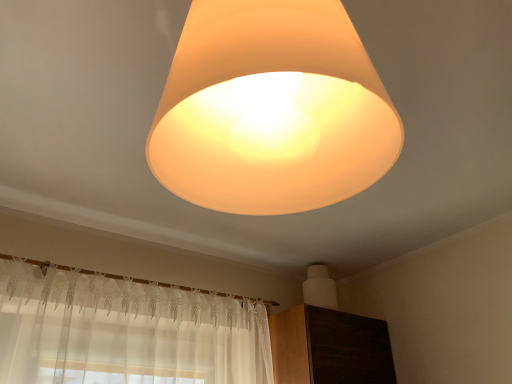
The height and width of the screenshot is (384, 512). Describe the element at coordinates (329, 347) in the screenshot. I see `dark wood dresser at lower right` at that location.

You are a GUI agent. You are given a task and a screenshot of the screen. Output one action in this format:
    pyautogui.click(x=<x>, y=<y>)
    Task: Click on the dark wood dresser at lower right
    The image size is (512, 384).
    Given the screenshot: What is the action you would take?
    pyautogui.click(x=329, y=347)

This screenshot has width=512, height=384. Describe the element at coordinates (272, 110) in the screenshot. I see `matte orange lampshade at upper center` at that location.

Where is `matte orange lampshade at upper center`? The width and height of the screenshot is (512, 384). matte orange lampshade at upper center is located at coordinates (272, 110).

At what (x,y) coordinates should I click in order to perform the action: click on dark wood dresser at lower right. Please return your answer as a coordinate pair (x, y). The width and height of the screenshot is (512, 384). Looking at the image, I should click on (329, 347).

Is matte orange lampshade at upper center at the right side of dark wood dresser at lower right?

In fact, matte orange lampshade at upper center is to the left of dark wood dresser at lower right.

Consider the image. Does matte orange lampshade at upper center lie behind dark wood dresser at lower right?

No, matte orange lampshade at upper center is closer to the camera.

Considering the positions of points (300, 151) and (380, 366), is point (300, 151) farther from camera compared to point (380, 366)?

No.

From the image's perspective, which is above, matte orange lampshade at upper center or dark wood dresser at lower right?

matte orange lampshade at upper center appears higher in the image.

From a real-world perspective, is matte orange lampshade at upper center over dark wood dresser at lower right?

Yes, from a real-world perspective, matte orange lampshade at upper center is over dark wood dresser at lower right

Considering the sizes of matte orange lampshade at upper center and dark wood dresser at lower right in the image, is matte orange lampshade at upper center wider or thinner than dark wood dresser at lower right?

Clearly, matte orange lampshade at upper center has less width compared to dark wood dresser at lower right.

In terms of height, does matte orange lampshade at upper center look taller or shorter compared to dark wood dresser at lower right?

matte orange lampshade at upper center is taller than dark wood dresser at lower right.

Is matte orange lampshade at upper center smaller than dark wood dresser at lower right?

Correct, matte orange lampshade at upper center occupies less space than dark wood dresser at lower right.

Is matte orange lampshade at upper center outside of dark wood dresser at lower right?

That's correct, matte orange lampshade at upper center is outside of dark wood dresser at lower right.

Is matte orange lampshade at upper center next to dark wood dresser at lower right and touching it?

No, matte orange lampshade at upper center is not with dark wood dresser at lower right.

Is matte orange lampshade at upper center facing towards dark wood dresser at lower right?

No, matte orange lampshade at upper center is not aimed at dark wood dresser at lower right.

Looking at this image, how different are the orientations of matte orange lampshade at upper center and dark wood dresser at lower right in degrees?

The angle between the facing direction of matte orange lampshade at upper center and the facing direction of dark wood dresser at lower right is 100 degrees.

How distant is matte orange lampshade at upper center from dark wood dresser at lower right?

The distance of matte orange lampshade at upper center from dark wood dresser at lower right is 4.88 feet.

There is a dark wood dresser at lower right. Identify the location of lamp above it (from a real-world perspective). (272, 110).

In the scene shown: Which is more to the left, dark wood dresser at lower right or matte orange lampshade at upper center?

Positioned to the left is matte orange lampshade at upper center.

Considering the relative positions of dark wood dresser at lower right and matte orange lampshade at upper center in the image provided, is dark wood dresser at lower right in front of matte orange lampshade at upper center?

No, dark wood dresser at lower right is behind matte orange lampshade at upper center.

Does point (375, 328) come closer to viewer compared to point (234, 84)?

No, it is not.

From the image's perspective, is dark wood dresser at lower right above matte orange lampshade at upper center?

No, from the image's perspective, dark wood dresser at lower right is not on top of matte orange lampshade at upper center.

From a real-world perspective, between dark wood dresser at lower right and matte orange lampshade at upper center, who is vertically higher?

matte orange lampshade at upper center.

Which of these two, dark wood dresser at lower right or matte orange lampshade at upper center, is thinner?

Thinner between the two is matte orange lampshade at upper center.

Considering the sizes of objects dark wood dresser at lower right and matte orange lampshade at upper center in the image provided, who is taller, dark wood dresser at lower right or matte orange lampshade at upper center?

With more height is matte orange lampshade at upper center.

Who is bigger, dark wood dresser at lower right or matte orange lampshade at upper center?

Bigger between the two is dark wood dresser at lower right.

Is dark wood dresser at lower right inside or outside of matte orange lampshade at upper center?

dark wood dresser at lower right is located beyond the bounds of matte orange lampshade at upper center.

Does dark wood dresser at lower right touch matte orange lampshade at upper center?

No, dark wood dresser at lower right is not making contact with matte orange lampshade at upper center.

Based on the photo, is dark wood dresser at lower right positioned with its back to matte orange lampshade at upper center?

No, dark wood dresser at lower right's orientation is not away from matte orange lampshade at upper center.

Can you tell me how much dark wood dresser at lower right and matte orange lampshade at upper center differ in facing direction?

100 degrees separate the facing orientations of dark wood dresser at lower right and matte orange lampshade at upper center.

This screenshot has height=384, width=512. Find the location of `dresser below the matte orange lampshade at upper center (from the image's perspective)`. dresser below the matte orange lampshade at upper center (from the image's perspective) is located at coordinates (329, 347).

What are the coordinates of `dresser below the matte orange lampshade at upper center (from a real-world perspective)` in the screenshot? It's located at (329, 347).

The width and height of the screenshot is (512, 384). What are the coordinates of `dresser to the right of matte orange lampshade at upper center` in the screenshot? It's located at (329, 347).